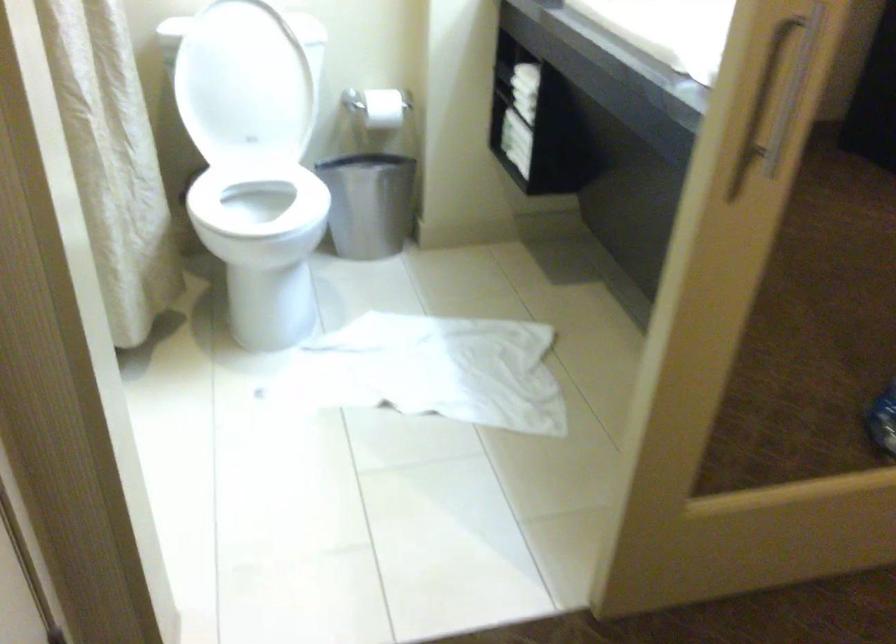
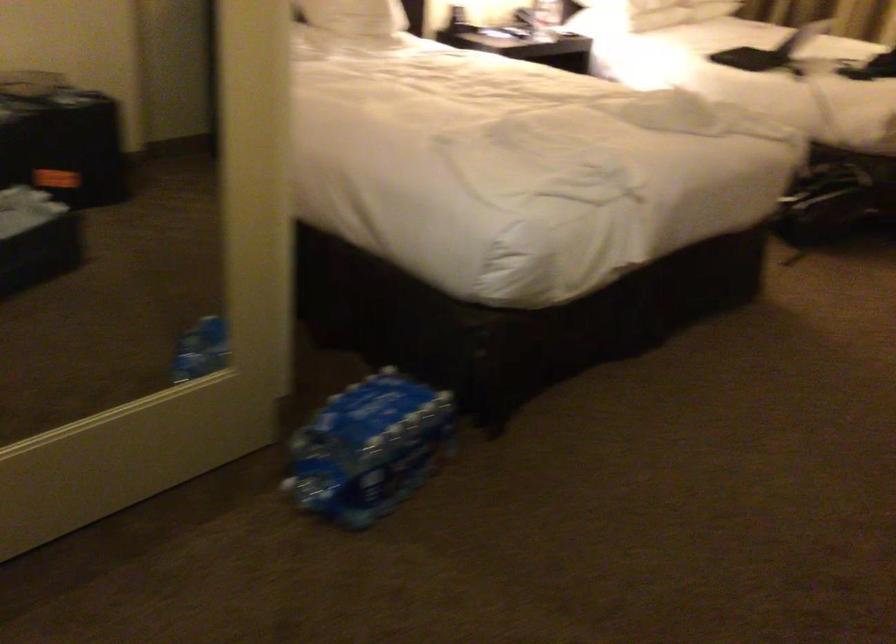
Question: The camera is either moving clockwise (left) or counter-clockwise (right) around the object. The first image is from the beginning of the video and the second image is from the end. Is the camera moving left or right when shooting the video?

Choices:
 (A) Left
 (B) Right

Answer: (A)